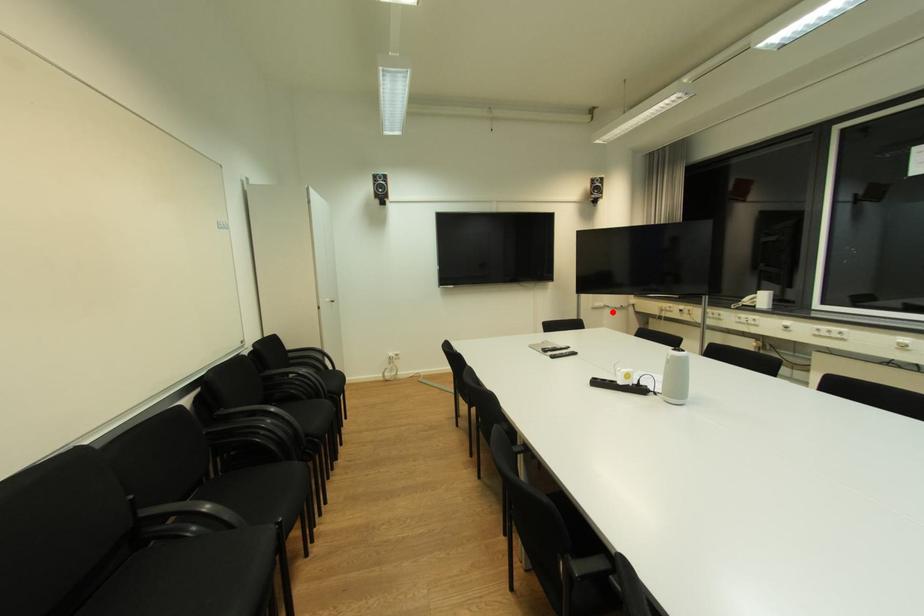
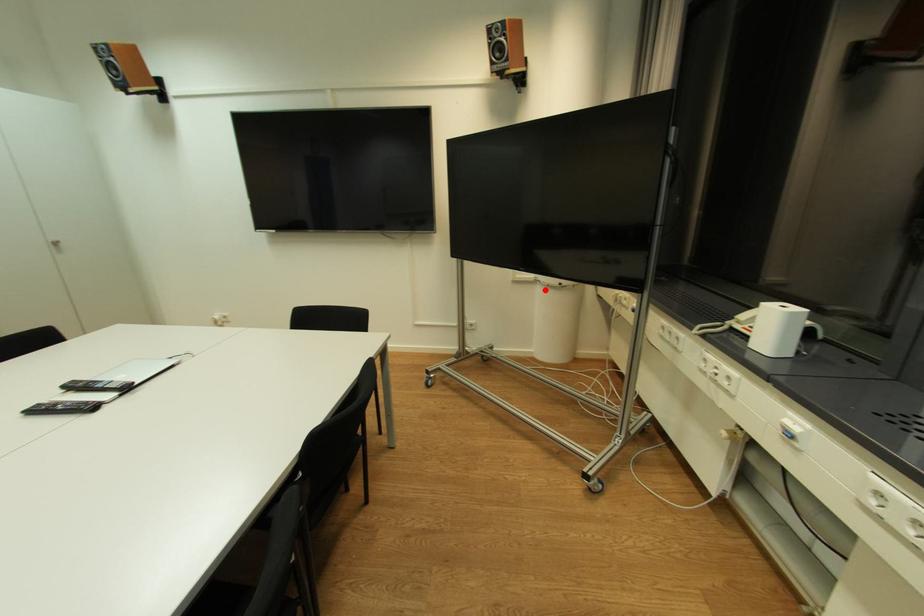
I am providing you with two images of the same scene from different viewpoints. A red point is marked on the first image and another point is marked on the second image. Does the point marked in image1 correspond to the same location as the one in image2?

Yes